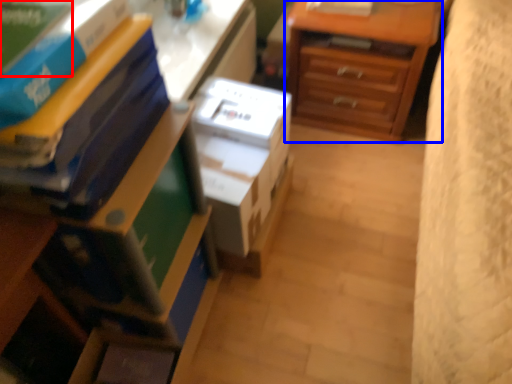
Question: Which of the following is the farthest to the observer, paperback book (highlighted by a red box) or chest of drawers (highlighted by a blue box)?

Choices:
 (A) paperback book
 (B) chest of drawers

Answer: (B)